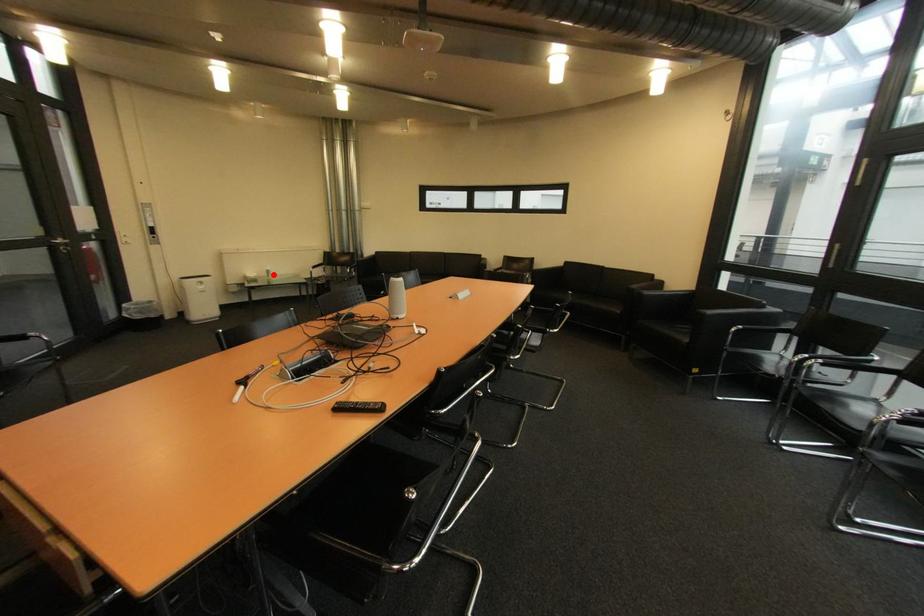
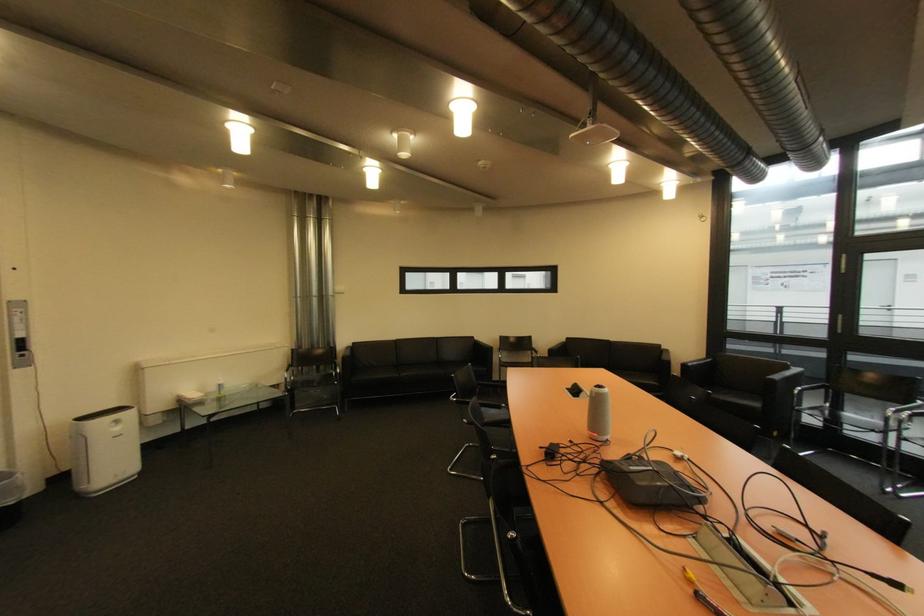
Question: I am providing you with two images of the same scene from different viewpoints. In image1, a red point is highlighted. Considering the same 3D point in image2, which of the following is correct?

Choices:
 (A) It is closer
 (B) It is farther

Answer: (B)